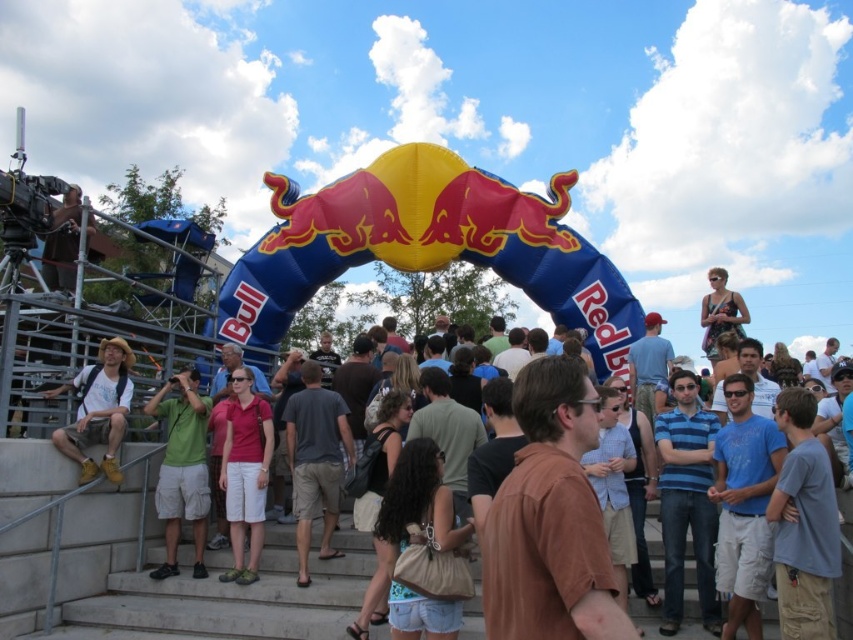
Can you confirm if matte gray shirt at center is wider than green shirt at center?

Indeed, matte gray shirt at center has a greater width compared to green shirt at center.

Is matte gray shirt at center bigger than green shirt at center?

Yes, matte gray shirt at center is bigger than green shirt at center.

Image resolution: width=853 pixels, height=640 pixels. What do you see at coordinates (512, 353) in the screenshot?
I see `matte gray shirt at center` at bounding box center [512, 353].

At what (x,y) coordinates should I click in order to perform the action: click on matte gray shirt at center. Please return your answer as a coordinate pair (x, y). Image resolution: width=853 pixels, height=640 pixels. Looking at the image, I should click on (512, 353).

Does point (193, 417) lie behind point (490, 353)?

No.

Who is lower down, green cotton shirt at lower left or green shirt at center?

Positioned lower is green cotton shirt at lower left.

The width and height of the screenshot is (853, 640). I want to click on green cotton shirt at lower left, so click(x=183, y=468).

Identify the location of green cotton shirt at lower left. This screenshot has width=853, height=640. (183, 468).

What do you see at coordinates (448, 433) in the screenshot? I see `dark brown leather jacket at center` at bounding box center [448, 433].

Is dark brown leather jacket at center closer to camera compared to green shirt at center?

Yes, it is in front of green shirt at center.

Is point (462, 508) closer to camera compared to point (490, 321)?

Yes, point (462, 508) is closer to viewer.

Identify the location of dark brown leather jacket at center. (448, 433).